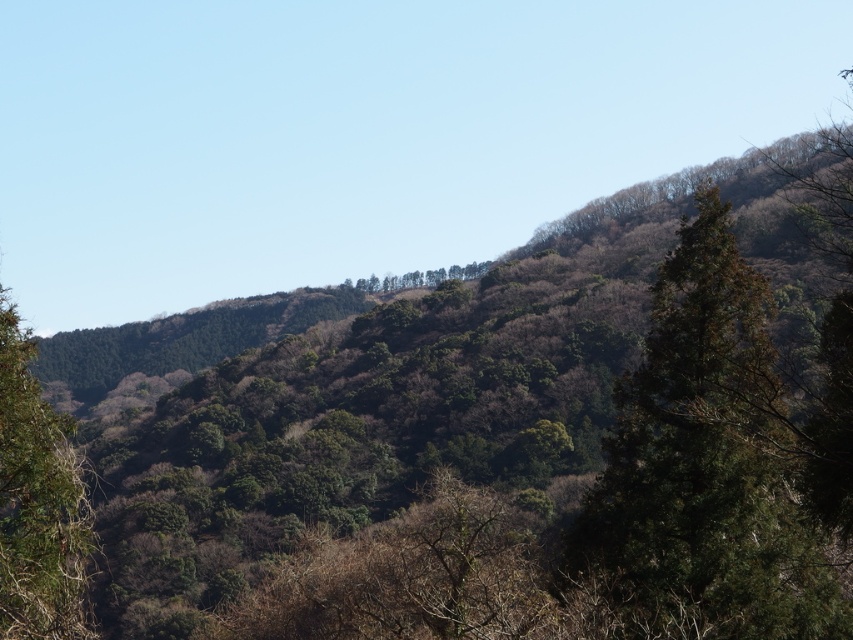
You are a hiker standing at the base of the hill and see the green leafy tree at left and the green leafy trees at center. Which group of trees is closer to you?

The green leafy tree at left is closer to you because it is in front of the green leafy trees at center, which are further away.

You are a hiker trying to navigate through the forest. You notice the dark green textured tree at upper right and the green leafy trees at center. Which tree group is closer to you?

The dark green textured tree at upper right is closer to you because it is in front of the green leafy trees at center.

You are a hiker trying to navigate through the forest. You notice the dark green textured tree at upper right and the green leafy trees at center. Which tree would be harder to see around when moving towards the center of the scene?

The dark green textured tree at upper right is smaller in size compared to the green leafy trees at center, so it would be harder to see around when moving towards the center of the scene because its smaller size might be obscured by the larger trees.